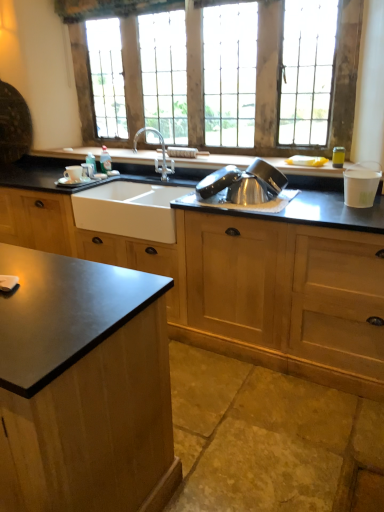
Locate an element on the screen. free spot to the left of yellow plastic coffee maker at right is located at coordinates (313, 168).